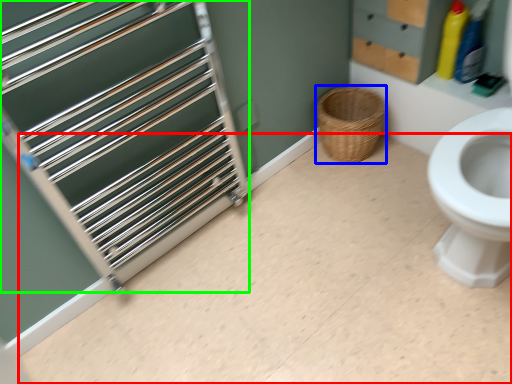
Question: Considering the real-world distances, which object is closest to plain (highlighted by a red box)? basket (highlighted by a blue box) or cage (highlighted by a green box).

Choices:
 (A) basket
 (B) cage

Answer: (B)